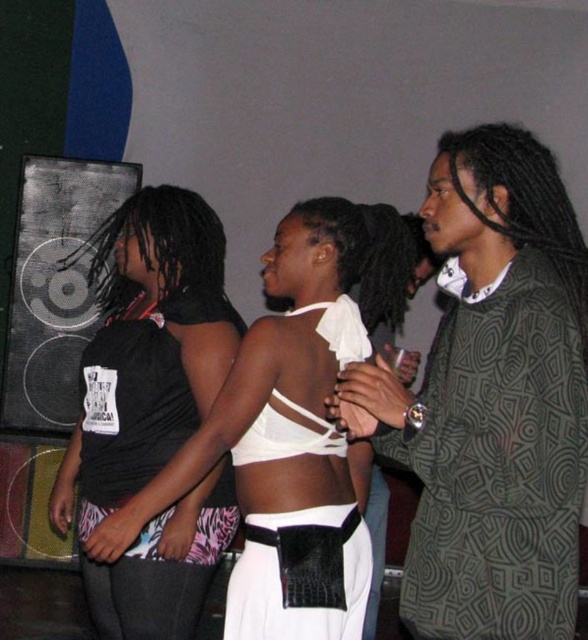
You are at a party and want to know the spatial relationship between the black matte tank top at left and the white matte tank top at center. Which one is positioned higher in the image?

The white matte tank top at center is positioned higher than the black matte tank top at left.

You are organizing a charity event and need to decide which of the two shirts, the patterned fabric shirt at right or the black matte tank top at left, can fit into a narrow donation box. Based on their thickness, which one is more likely to fit?

The patterned fabric shirt at right is thinner than the black matte tank top at left, so it is more likely to fit into the narrow donation box.